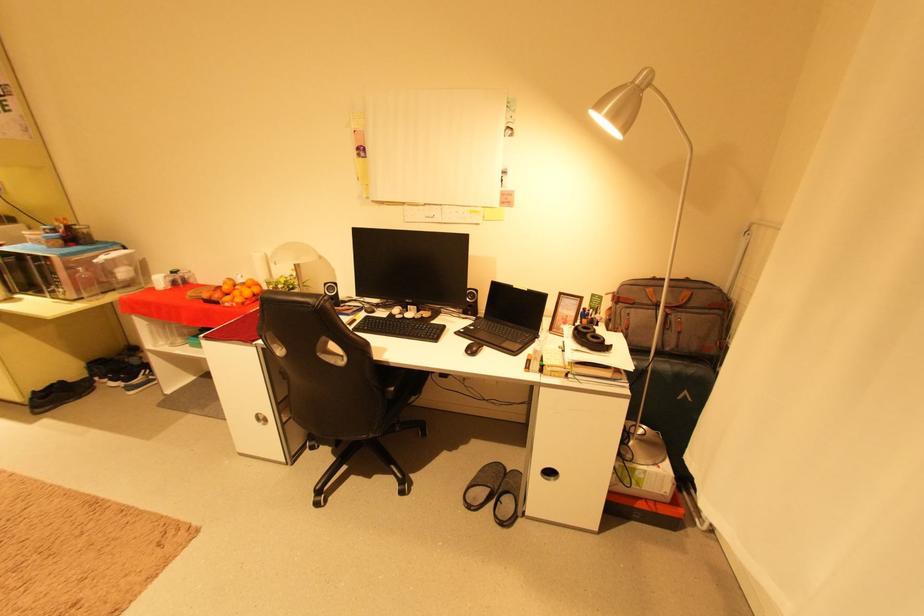
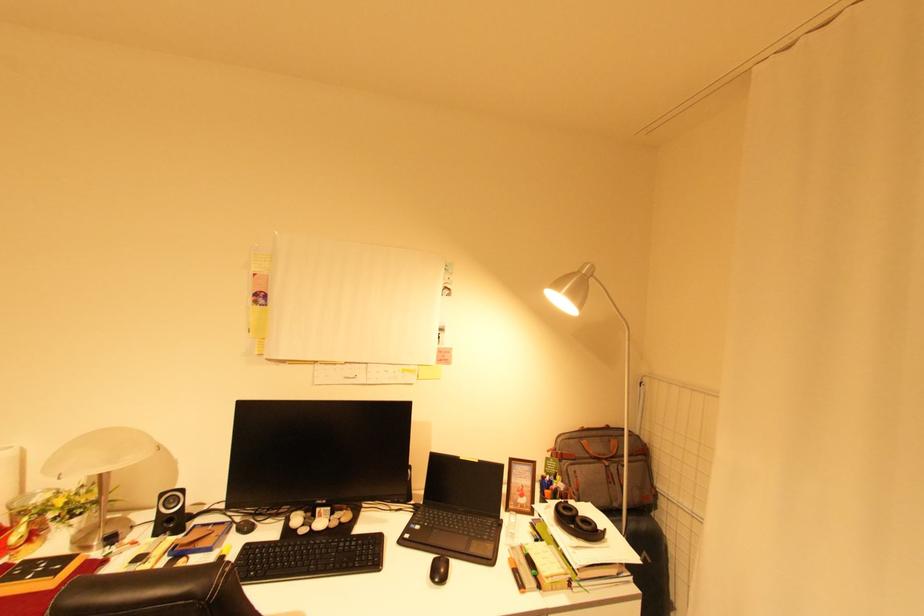
The first image is from the beginning of the video and the second image is from the end. How did the camera likely rotate when shooting the video?

The rotation direction of the camera is right-up.